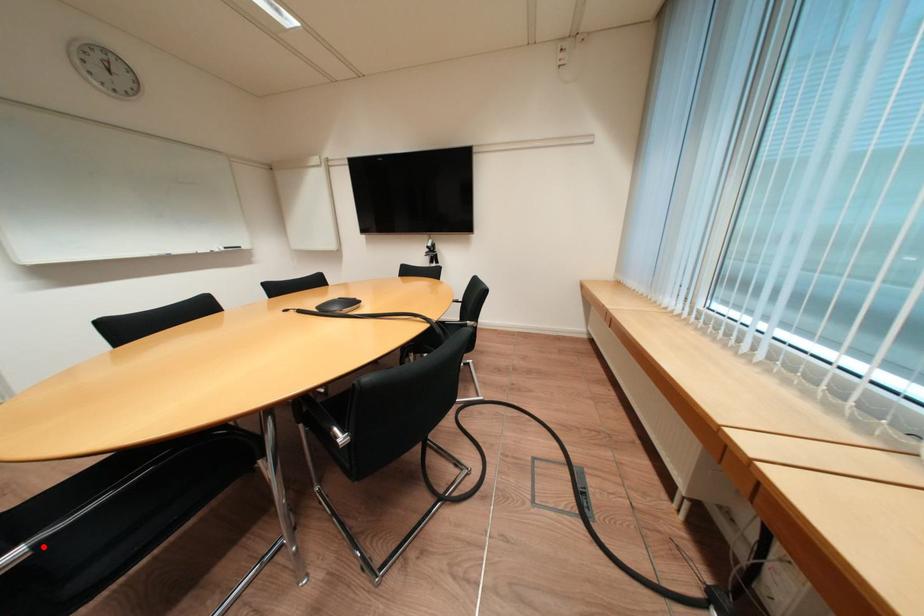
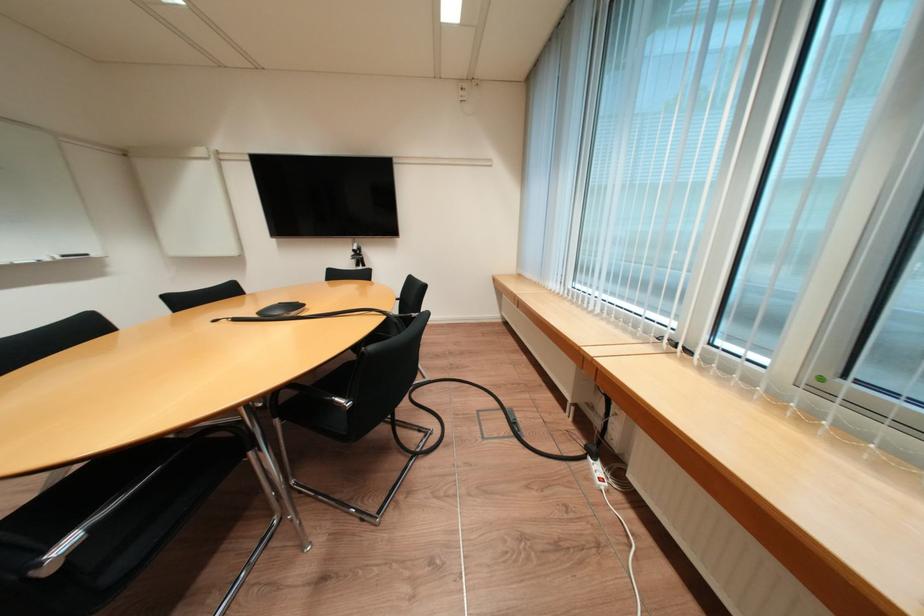
Question: A red point is marked in image1. In image2, is the corresponding 3D point closer to the camera or farther? Reply with the corresponding letter.

Choices:
 (A) The corresponding 3D point is closer.
 (B) The corresponding 3D point is farther.

Answer: (B)